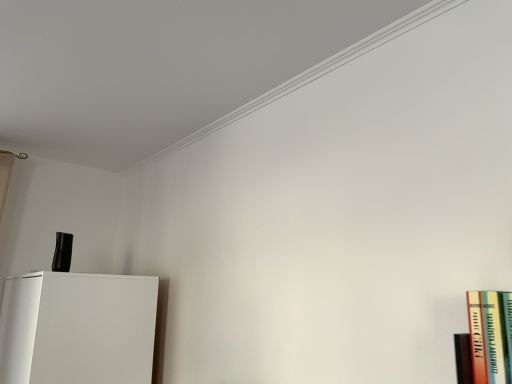
Question: Do you think white matte cabinet at lower left is within hardcover book at right, or outside of it?

Choices:
 (A) outside
 (B) inside

Answer: (A)

Question: From the image's perspective, is white matte cabinet at lower left positioned above or below hardcover book at right?

Choices:
 (A) above
 (B) below

Answer: (B)

Question: Would you say white matte cabinet at lower left is to the left or to the right of hardcover book at right in the picture?

Choices:
 (A) left
 (B) right

Answer: (A)

Question: From the image's perspective, is hardcover book at right positioned above or below white matte cabinet at lower left?

Choices:
 (A) below
 (B) above

Answer: (B)

Question: Does point (502, 327) appear closer or farther from the camera than point (101, 364)?

Choices:
 (A) farther
 (B) closer

Answer: (B)

Question: In the image, is hardcover book at right positioned in front of or behind white matte cabinet at lower left?

Choices:
 (A) behind
 (B) front

Answer: (B)

Question: From a real-world perspective, relative to white matte cabinet at lower left, is hardcover book at right vertically above or below?

Choices:
 (A) below
 (B) above

Answer: (B)